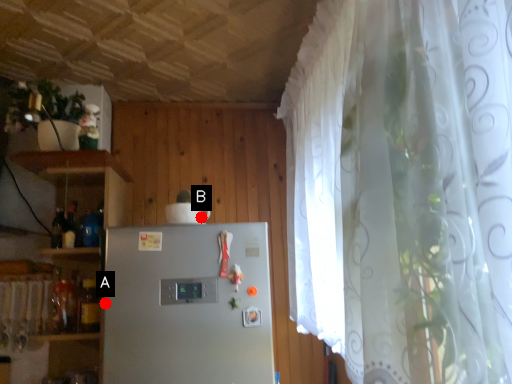
Question: Two points are circled on the image, labeled by A and B beside each circle. Among these points, which one is nearest to the camera?

Choices:
 (A) A is closer
 (B) B is closer

Answer: (A)